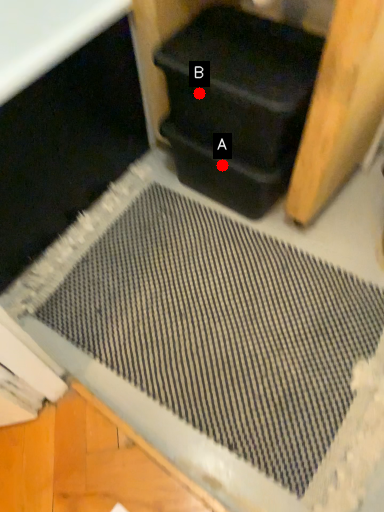
Question: Two points are circled on the image, labeled by A and B beside each circle. Which point is farther from the camera taking this photo?

Choices:
 (A) A is further
 (B) B is further

Answer: (A)